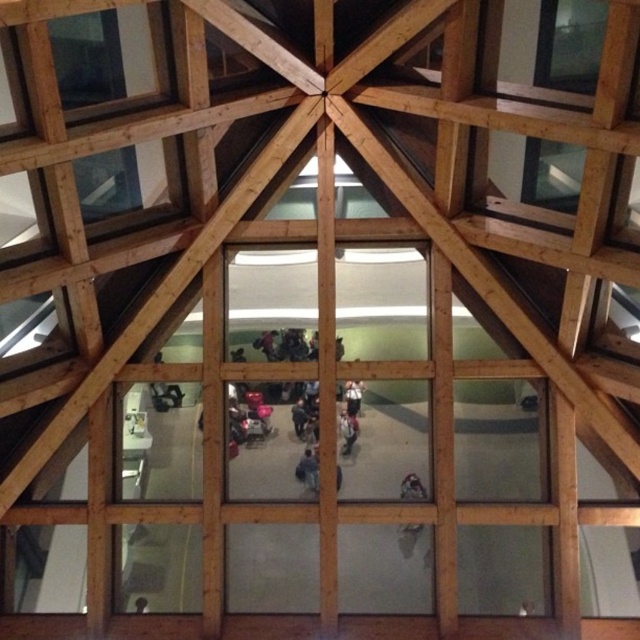
Question: Which point is closer to the camera?

Choices:
 (A) coord(305,472)
 (B) coord(304,404)

Answer: (A)

Question: Which of these objects is positioned closest to the dark gray fabric jacket at center?

Choices:
 (A) light brown leather jacket at center
 (B) dark blue jeans at center

Answer: (B)

Question: Which point appears closest to the camera in this image?

Choices:
 (A) (307, 426)
 (B) (355, 419)

Answer: (B)

Question: Can you confirm if dark gray fabric jacket at center is wider than light brown leather jacket at center?

Choices:
 (A) yes
 (B) no

Answer: (A)

Question: Is the position of dark blue jeans at center more distant than that of dark gray fabric jacket at center?

Choices:
 (A) yes
 (B) no

Answer: (B)

Question: Does dark gray fabric jacket at center appear on the right side of light brown leather jacket at center?

Choices:
 (A) yes
 (B) no

Answer: (B)